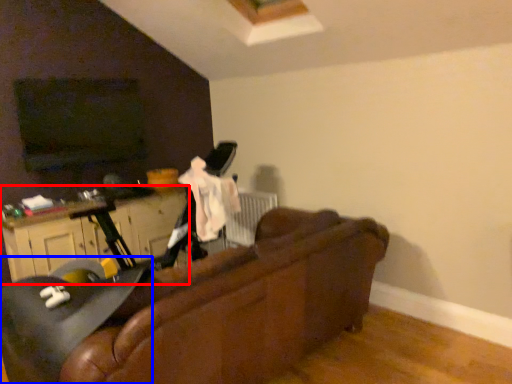
Question: Which of the following is the farthest to the observer, dresser (highlighted by a red box) or swivel chair (highlighted by a blue box)?

Choices:
 (A) dresser
 (B) swivel chair

Answer: (A)